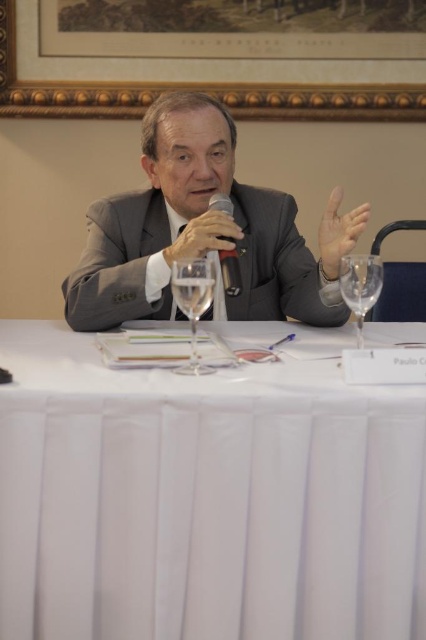
Based on the coordinates provided, can you identify which object is located at point [192,301] in the scene?

The clear glass wine glass at center is located at point [192,301].

You are a server at a formal event and need to place a 15 inch long decorative plate between the white cloth at center and the transparent glass wine glass at right. Will there be enough space?

The distance between the white cloth at center and the transparent glass wine glass at right is 17.03 inches. Since the plate is 15 inches long, there is enough space to place it between them.

What is the position of the white cloth at center in the image?

The white cloth at center is located at point (204, 499).